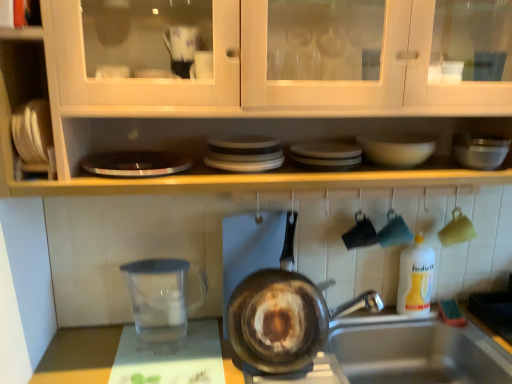
This screenshot has height=384, width=512. What are the coordinates of `blank area beneath transparent plastic measuring cup at lower left (from a real-world perspective)` in the screenshot? It's located at (153, 342).